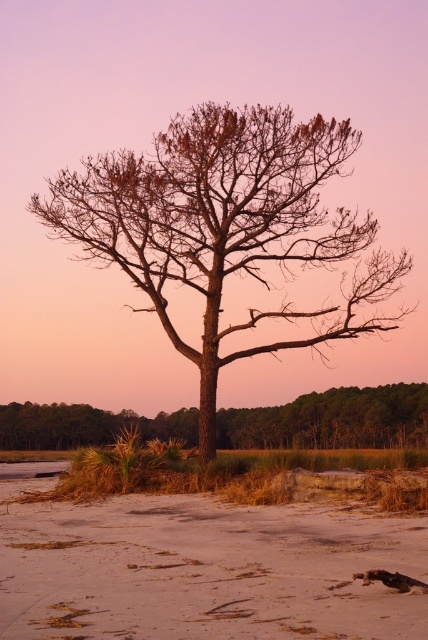
Question: Is sandy beige at lower center to the right of bare wood tree at center from the viewer's perspective?

Choices:
 (A) yes
 (B) no

Answer: (A)

Question: Which object is closer to the camera taking this photo?

Choices:
 (A) bare wood tree at center
 (B) brown textured tree at center
 (C) sandy beige at lower center

Answer: (C)

Question: Is sandy beige at lower center behind bare wood tree at center?

Choices:
 (A) no
 (B) yes

Answer: (A)

Question: Is sandy beige at lower center to the right of bare wood tree at center from the viewer's perspective?

Choices:
 (A) no
 (B) yes

Answer: (B)

Question: Among these objects, which one is nearest to the camera?

Choices:
 (A) bare wood tree at center
 (B) sandy beige at lower center

Answer: (B)

Question: Which point is farther to the camera?

Choices:
 (A) sandy beige at lower center
 (B) brown textured tree at center

Answer: (B)